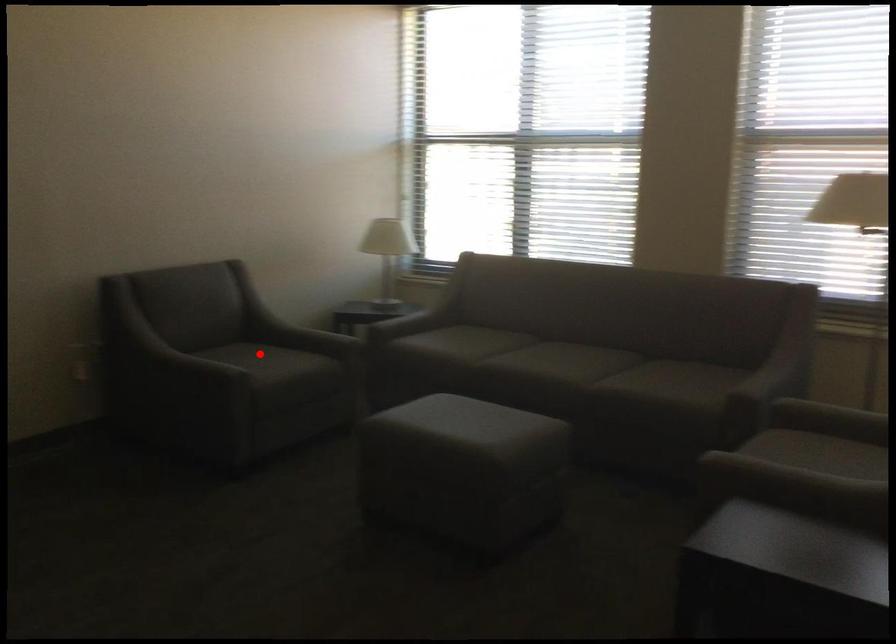
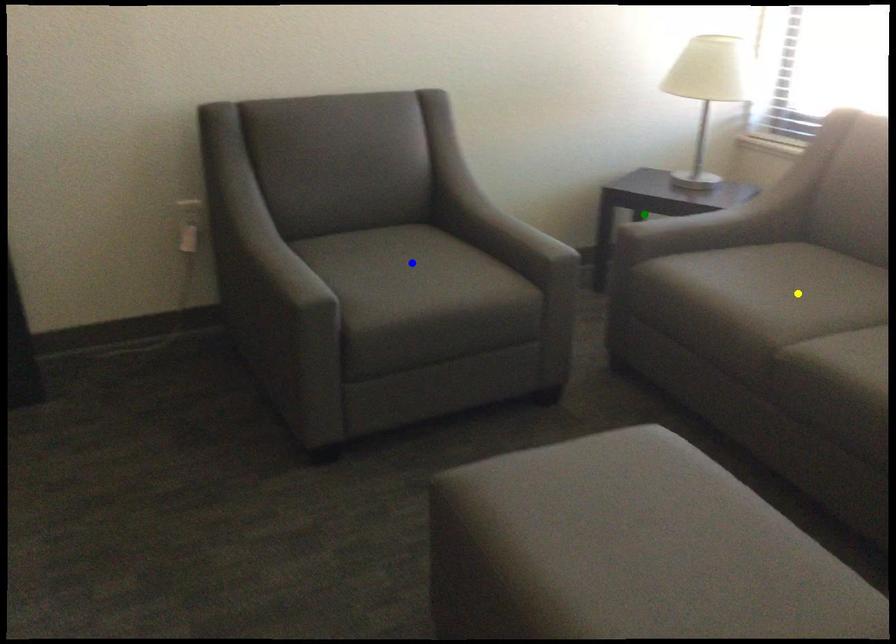
Question: I am providing you with two images of the same scene from different viewpoints. A red point is marked on the first image. You are given multiple points on the second image. Can you choose the point in image 2 that corresponds to the point in image 1?

Choices:
 (A) green point
 (B) yellow point
 (C) blue point

Answer: (C)